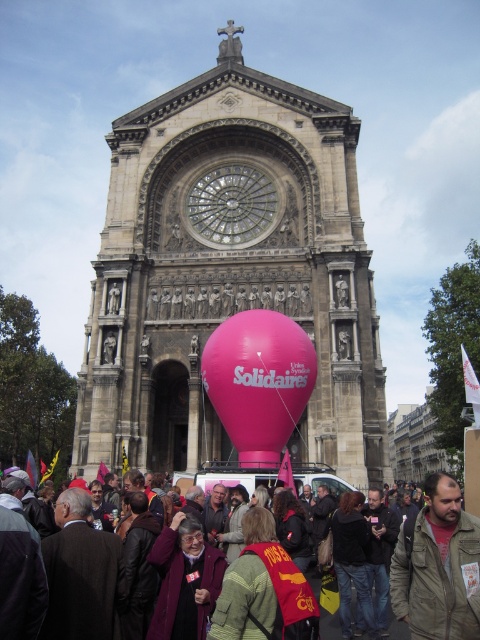
Question: Considering the real-world distances, which object is farthest from the pink matte balloon at center?

Choices:
 (A) clear glass clock at center
 (B) pink fabric crowd at lower center
 (C) pink fabric balloon at center

Answer: (A)

Question: Observing the image, what is the correct spatial positioning of pink fabric balloon at center in reference to pink fabric crowd at lower center?

Choices:
 (A) below
 (B) above

Answer: (B)

Question: Which is farther from the clear glass clock at center?

Choices:
 (A) pink fabric crowd at lower center
 (B) pink matte balloon at center

Answer: (A)

Question: Is pink matte balloon at center to the right of brown textured jacket at lower right from the viewer's perspective?

Choices:
 (A) yes
 (B) no

Answer: (B)

Question: Does brown textured jacket at lower right have a smaller size compared to clear glass clock at center?

Choices:
 (A) no
 (B) yes

Answer: (B)

Question: Which point is closer to the camera?

Choices:
 (A) pink matte balloon at center
 (B) clear glass clock at center
 (C) pink fabric crowd at lower center
 (D) brown textured jacket at lower right

Answer: (D)